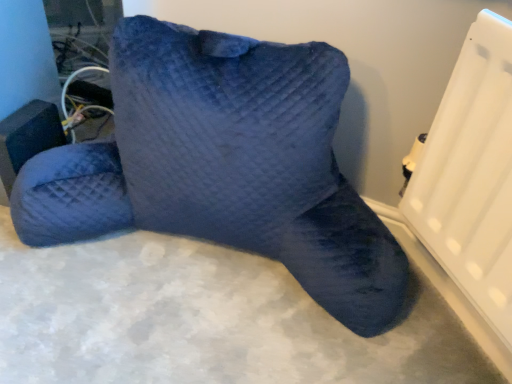
Question: From a real-world perspective, is velvet blue pillow at center beneath matte black speaker at lower left?

Choices:
 (A) no
 (B) yes

Answer: (A)

Question: Is the position of velvet blue pillow at center more distant than that of matte black speaker at lower left?

Choices:
 (A) no
 (B) yes

Answer: (A)

Question: Can you confirm if velvet blue pillow at center is taller than matte black speaker at lower left?

Choices:
 (A) no
 (B) yes

Answer: (B)

Question: Considering the relative sizes of velvet blue pillow at center and matte black speaker at lower left in the image provided, is velvet blue pillow at center bigger than matte black speaker at lower left?

Choices:
 (A) no
 (B) yes

Answer: (B)

Question: Is velvet blue pillow at center to the left of matte black speaker at lower left from the viewer's perspective?

Choices:
 (A) yes
 (B) no

Answer: (B)

Question: Does velvet blue pillow at center have a smaller size compared to matte black speaker at lower left?

Choices:
 (A) no
 (B) yes

Answer: (A)

Question: From the image's perspective, is matte black speaker at lower left beneath velvet blue pillow at center?

Choices:
 (A) no
 (B) yes

Answer: (B)

Question: Can you confirm if matte black speaker at lower left is smaller than velvet blue pillow at center?

Choices:
 (A) no
 (B) yes

Answer: (B)

Question: Considering the relative sizes of matte black speaker at lower left and velvet blue pillow at center in the image provided, is matte black speaker at lower left shorter than velvet blue pillow at center?

Choices:
 (A) no
 (B) yes

Answer: (B)

Question: Is matte black speaker at lower left facing away from velvet blue pillow at center?

Choices:
 (A) yes
 (B) no

Answer: (A)

Question: From a real-world perspective, is matte black speaker at lower left over velvet blue pillow at center?

Choices:
 (A) no
 (B) yes

Answer: (A)

Question: Is matte black speaker at lower left oriented towards velvet blue pillow at center?

Choices:
 (A) no
 (B) yes

Answer: (B)

Question: Based on their sizes in the image, would you say velvet blue pillow at center is bigger or smaller than matte black speaker at lower left?

Choices:
 (A) big
 (B) small

Answer: (A)